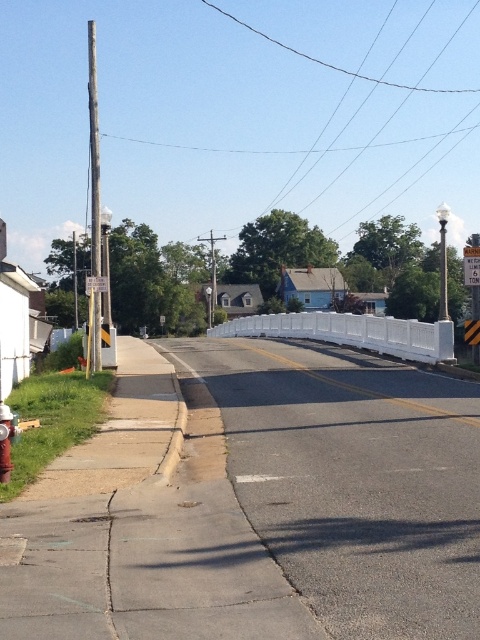
Is point (322, 339) less distant than point (9, 419)?

No, it is behind (9, 419).

Who is more distant from viewer, (330, 340) or (0, 422)?

Positioned behind is point (330, 340).

What do you see at coordinates (351, 332) in the screenshot? The height and width of the screenshot is (640, 480). I see `white plastic barricade at center` at bounding box center [351, 332].

I want to click on white plastic barricade at center, so click(x=351, y=332).